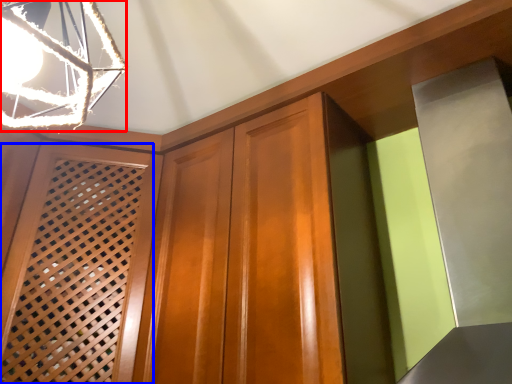
Question: Which of the following is the farthest to the observer, lamp (highlighted by a red box) or screen door (highlighted by a blue box)?

Choices:
 (A) lamp
 (B) screen door

Answer: (B)